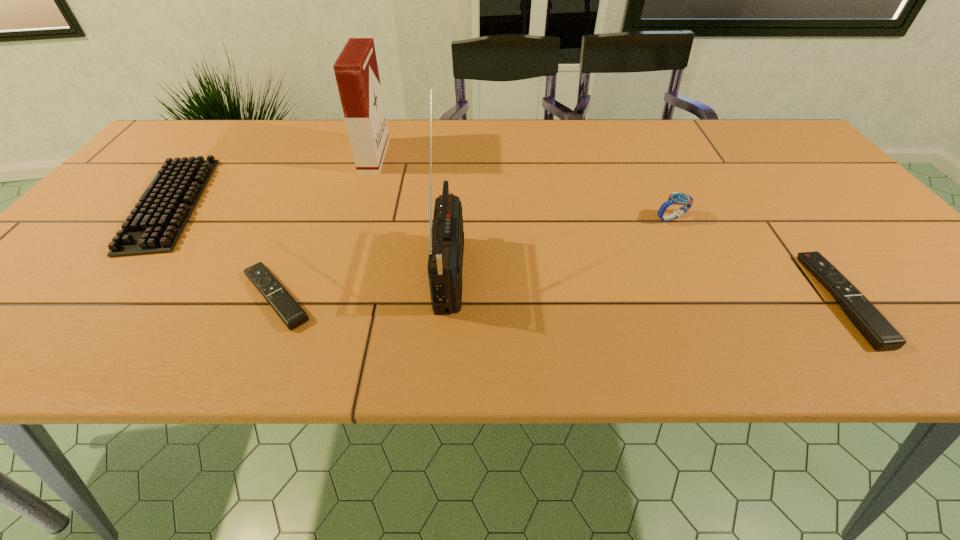
This screenshot has width=960, height=540. I want to click on free space located 0.370m on the back of the taller remote control, so click(x=738, y=162).

Image resolution: width=960 pixels, height=540 pixels. Find the location of `free space located 0.070m on the front-facing side of the fifth shortest object`. free space located 0.070m on the front-facing side of the fifth shortest object is located at coordinates (410, 156).

The height and width of the screenshot is (540, 960). Find the location of `vacant space located 0.120m on the front of the watch`. vacant space located 0.120m on the front of the watch is located at coordinates (693, 261).

Locate an element on the screen. The height and width of the screenshot is (540, 960). vacant space located on the right of the computer keyboard is located at coordinates click(x=270, y=204).

I want to click on free region located on the front-facing side of the radio receiver, so click(x=619, y=268).

Identify the location of cigarette_case situated at the far edge. (356, 70).

Identify the location of computer keyboard at the far edge. The image size is (960, 540). (157, 221).

This screenshot has height=540, width=960. What are the coordinates of `radio receiver that is at the near edge` in the screenshot? It's located at (446, 236).

Image resolution: width=960 pixels, height=540 pixels. Identify the location of object situated at the left edge. (157, 221).

This screenshot has width=960, height=540. Find the location of `object that is at the far left corner`. object that is at the far left corner is located at coordinates (157, 221).